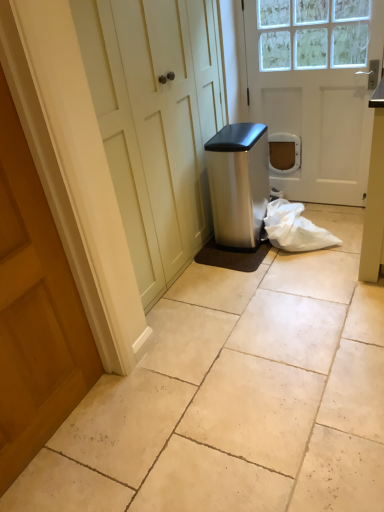
Question: From a real-world perspective, is white plastic bag at lower right above or below beige tile floor at center?

Choices:
 (A) above
 (B) below

Answer: (A)

Question: From the image's perspective, is white plastic bag at lower right above or below beige tile floor at center?

Choices:
 (A) below
 (B) above

Answer: (B)

Question: Which of these objects is positioned farthest from the white plastic bag at lower right?

Choices:
 (A) satin silver trash can at center
 (B) beige tile floor at center
 (C) white matte door at center, the 1th door when ordered from back to front
 (D) wooden door at left, the 1th door from the bottom

Answer: (D)

Question: Which object is the closest to the satin silver trash can at center?

Choices:
 (A) beige tile floor at center
 (B) wooden door at left, the 1th door from the bottom
 (C) white plastic bag at lower right
 (D) white matte door at center, placed as the first door when sorted from right to left

Answer: (C)